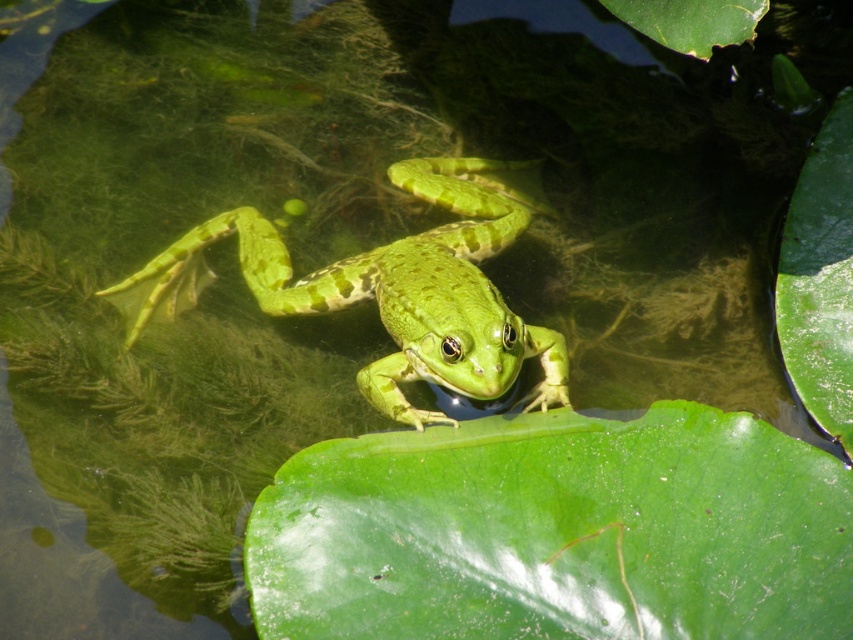
The width and height of the screenshot is (853, 640). Describe the element at coordinates (556, 532) in the screenshot. I see `green glossy leaf at center` at that location.

Which is behind, point (782, 552) or point (498, 248)?

Positioned behind is point (498, 248).

You are a GUI agent. You are given a task and a screenshot of the screen. Output one action in this format:
    pyautogui.click(x=<x>, y=<y>)
    Task: Click on the green glossy leaf at center
    
    Given the screenshot: What is the action you would take?
    pyautogui.click(x=556, y=532)

At what (x,y) coordinates should I click in order to perform the action: click on green glossy leaf at center. Please return your answer as a coordinate pair (x, y). The height and width of the screenshot is (640, 853). Looking at the image, I should click on (556, 532).

How far apart are green glossy leaf at center and green matte leaf at upper center?

green glossy leaf at center and green matte leaf at upper center are 33.89 inches apart from each other.

Does point (762, 515) come behind point (625, 8)?

No, it is not.

Find the location of a particular element. The image size is (853, 640). green glossy leaf at center is located at coordinates (556, 532).

Does green matte/skinny frog at center have a greater height compared to green matte leaf at upper center?

Indeed, green matte/skinny frog at center has a greater height compared to green matte leaf at upper center.

Measure the distance between green matte/skinny frog at center and camera.

green matte/skinny frog at center and camera are 1.76 meters apart from each other.

This screenshot has height=640, width=853. Find the location of `green matte/skinny frog at center`. green matte/skinny frog at center is located at coordinates (389, 289).